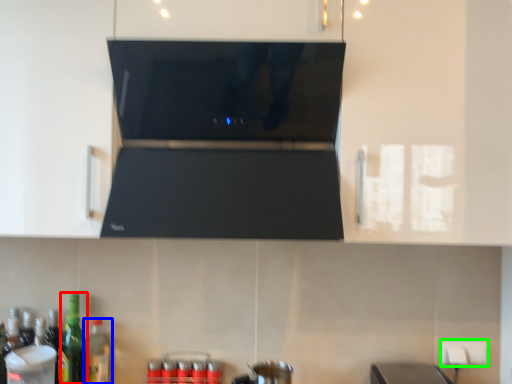
Question: Estimate the real-world distances between objects in this image. Which object is closer to bottle (highlighted by a red box), bottle (highlighted by a blue box) or electric outlet (highlighted by a green box)?

Choices:
 (A) bottle
 (B) electric outlet

Answer: (A)